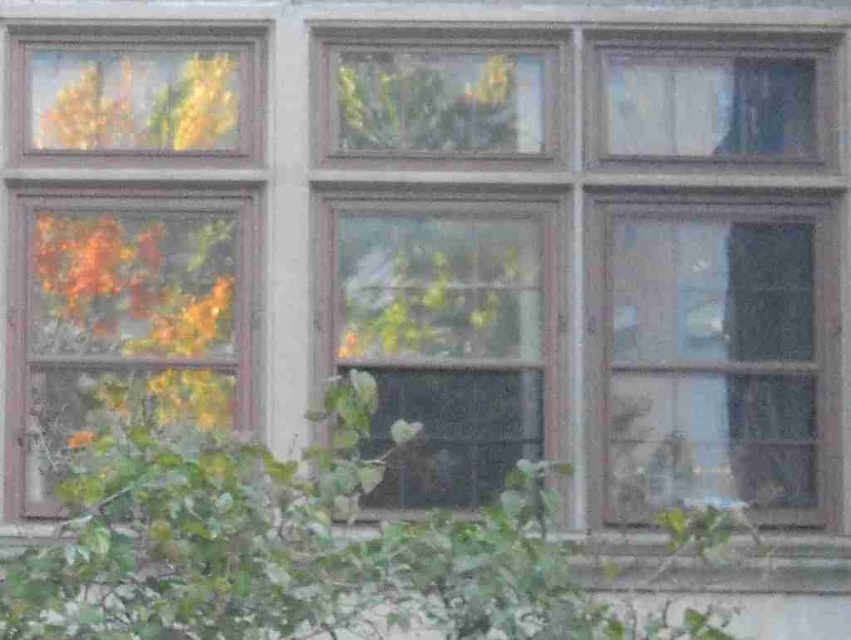
Is wooden window at left smaller than clear glass window at center?

No, wooden window at left is not smaller than clear glass window at center.

Does wooden window at left come in front of clear glass window at center?

Yes, wooden window at left is closer to the viewer.

In order to click on wooden window at left in this screenshot , I will do `click(129, 316)`.

The image size is (851, 640). Find the location of `wooden window at left`. wooden window at left is located at coordinates (129, 316).

Can you confirm if green leafy tree at center is shorter than transparent glass window at right?

Indeed, green leafy tree at center has a lesser height compared to transparent glass window at right.

Does point (271, 540) come farther from viewer compared to point (615, 388)?

No, it is not.

Where is `green leafy tree at center`? The width and height of the screenshot is (851, 640). green leafy tree at center is located at coordinates (298, 548).

Between transparent glass window at center and wooden window at left, which one has less height?

transparent glass window at center

Is transparent glass window at center taller than wooden window at left?

No.

Describe the element at coordinates (446, 337) in the screenshot. This screenshot has height=640, width=851. I see `transparent glass window at center` at that location.

Locate an element on the screen. The width and height of the screenshot is (851, 640). transparent glass window at center is located at coordinates (446, 337).